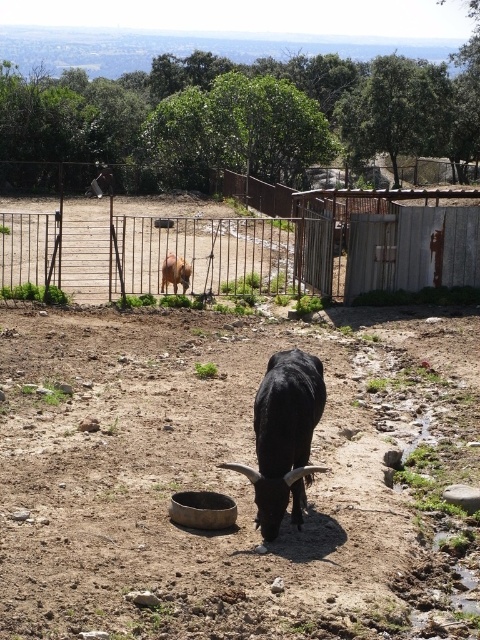
You are a farmer checking the enclosure. You need to place a new feeding bowl for the animals. The existing brown soil at center is where the current bowl is located. Based on the coordinates provided, where should you place the new bowl to ensure it is in the same area?

The new feeding bowl should be placed at the coordinates point (233, 477) where the brown soil at center is located.